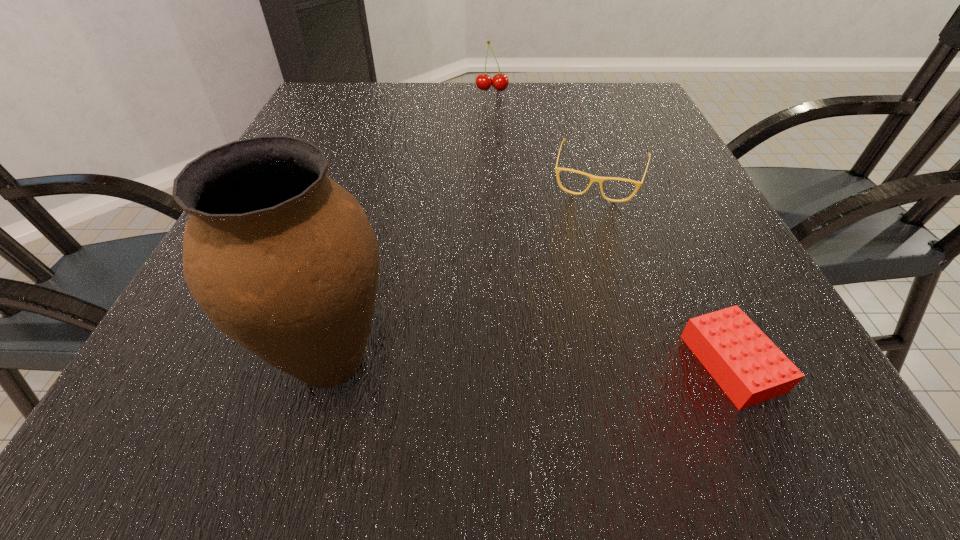
Find the location of a particular element. This screenshot has height=540, width=960. free space on the desktop that is between the urn and the Lego and is positioned in front of the lenses of the spectacles is located at coordinates coord(550,362).

This screenshot has height=540, width=960. Identify the location of free spot on the desktop that is between the urn and the Lego and is positioned with the stems of the second object from left to right pointing upwards. (481, 361).